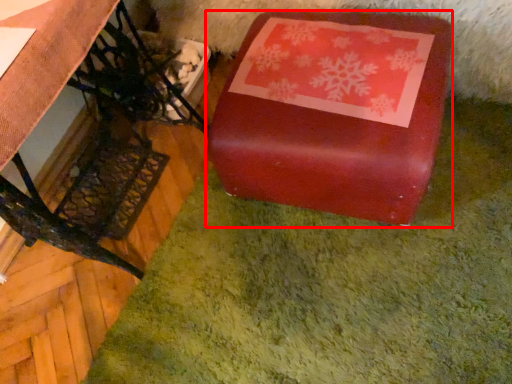
Question: From the image's perspective, where is table (annotated by the red box) located relative to furniture?

Choices:
 (A) below
 (B) above

Answer: (B)